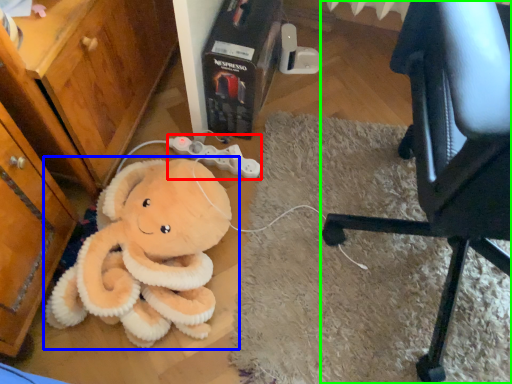
Question: Considering the real-world distances, which object is closest to game controller (highlighted by a red box)? toy (highlighted by a blue box) or chair (highlighted by a green box).

Choices:
 (A) toy
 (B) chair

Answer: (A)